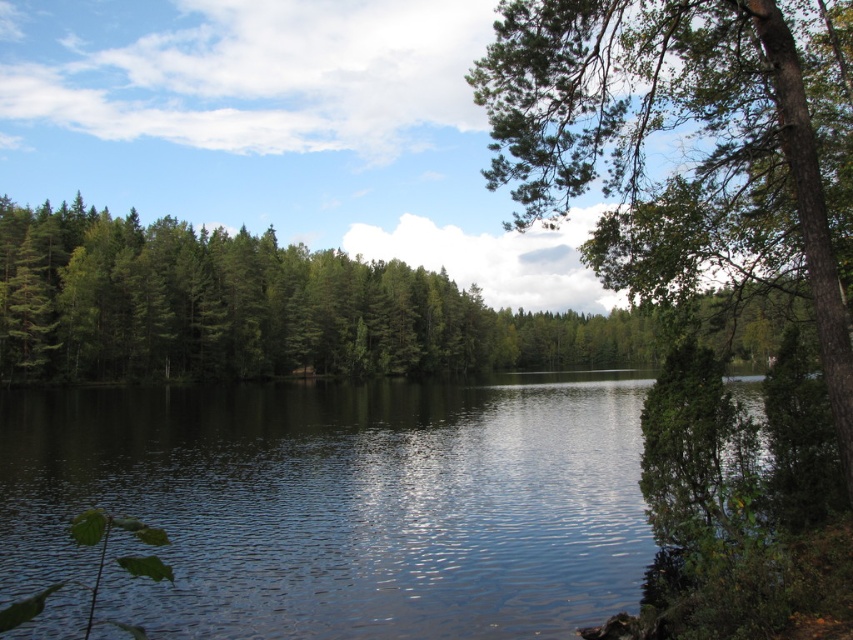
Question: Which object is closer to the camera taking this photo?

Choices:
 (A) green textured tree at upper right
 (B) clear water at center

Answer: (A)

Question: Is clear water at center smaller than green textured tree at upper right?

Choices:
 (A) yes
 (B) no

Answer: (A)

Question: Which point is closer to the camera?

Choices:
 (A) (656, 292)
 (B) (294, 544)

Answer: (A)

Question: Considering the relative positions of clear water at center and green textured tree at upper right in the image provided, where is clear water at center located with respect to green textured tree at upper right?

Choices:
 (A) below
 (B) above

Answer: (A)

Question: Is clear water at center below green textured tree at upper right?

Choices:
 (A) yes
 (B) no

Answer: (A)